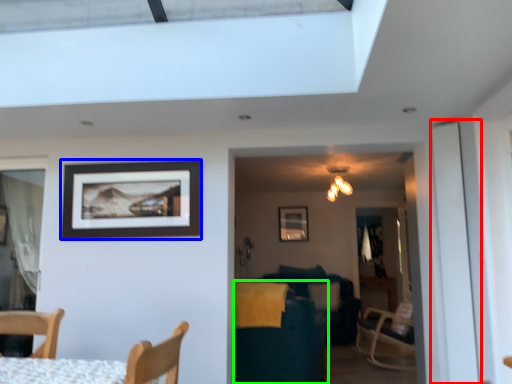
Question: Which object is positioned closest to screen door (highlighted by a red box)? Select from picture frame (highlighted by a blue box) and swivel chair (highlighted by a green box).

Choices:
 (A) picture frame
 (B) swivel chair

Answer: (B)